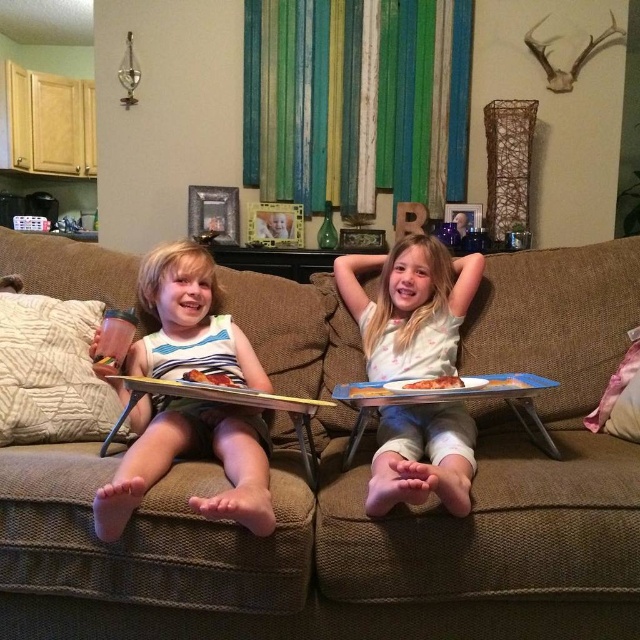
Question: Can you confirm if brown fabric couch at center is positioned above matte white tank top at left?

Choices:
 (A) no
 (B) yes

Answer: (A)

Question: In this image, where is matte white tank top at left located relative to wooden tray at left?

Choices:
 (A) left
 (B) right

Answer: (A)

Question: Based on their relative distances, which object is farther from the brown fabric couch at center?

Choices:
 (A) wooden tray at left
 (B) matte white tank top at left

Answer: (A)

Question: Can you confirm if brown fabric couch at center is thinner than matte white tank top at left?

Choices:
 (A) no
 (B) yes

Answer: (A)

Question: Which point is closer to the camera?

Choices:
 (A) wooden tray at left
 (B) white cotton shirt at center
 (C) brown fabric couch at center
 (D) matte white tank top at left

Answer: (D)

Question: Which object is farther from the camera taking this photo?

Choices:
 (A) white cotton shirt at center
 (B) brown fabric couch at center
 (C) matte white tank top at left
 (D) wooden tray at left

Answer: (D)